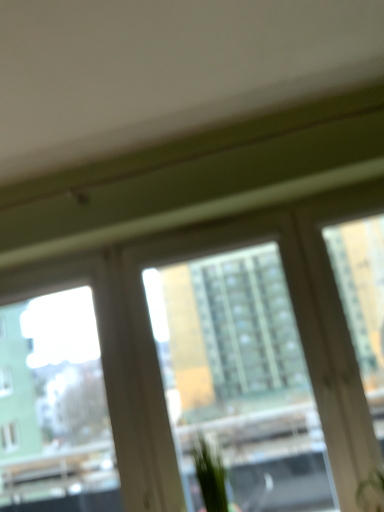
Question: Considering the relative sizes of green matte plant at lower right, placed as the first plant when sorted from right to left, and transparent glass window screen at left in the image provided, is green matte plant at lower right, placed as the first plant when sorted from right to left, thinner than transparent glass window screen at left?

Choices:
 (A) no
 (B) yes

Answer: (A)

Question: Does green matte plant at lower right, placed as the first plant when sorted from right to left, have a smaller size compared to transparent glass window screen at left?

Choices:
 (A) no
 (B) yes

Answer: (B)

Question: Is green matte plant at lower right, placed as the first plant when sorted from right to left, closer to camera compared to transparent glass window screen at left?

Choices:
 (A) no
 (B) yes

Answer: (B)

Question: Is green matte plant at lower right, arranged as the 2th plant when viewed from the left, far from transparent glass window screen at left?

Choices:
 (A) no
 (B) yes

Answer: (B)

Question: Could you tell me if green matte plant at lower right, placed as the first plant when sorted from right to left, is turned towards transparent glass window screen at left?

Choices:
 (A) yes
 (B) no

Answer: (B)

Question: From a real-world perspective, is green matte plant at lower right, placed as the first plant when sorted from right to left, on transparent glass window screen at left?

Choices:
 (A) no
 (B) yes

Answer: (A)

Question: From the image's perspective, is transparent glass window screen at left under transparent glass window at center?

Choices:
 (A) yes
 (B) no

Answer: (A)

Question: From a real-world perspective, is transparent glass window screen at left on transparent glass window at center?

Choices:
 (A) no
 (B) yes

Answer: (B)

Question: Does transparent glass window screen at left appear on the left side of transparent glass window at center?

Choices:
 (A) yes
 (B) no

Answer: (A)

Question: Are transparent glass window screen at left and transparent glass window at center far apart?

Choices:
 (A) yes
 (B) no

Answer: (B)

Question: Is transparent glass window screen at left bigger than transparent glass window at center?

Choices:
 (A) no
 (B) yes

Answer: (A)

Question: From a real-world perspective, is transparent glass window screen at left positioned under transparent glass window at center based on gravity?

Choices:
 (A) no
 (B) yes

Answer: (A)

Question: From the image's perspective, would you say transparent glass window at center is shown under green leafy plant at center, the 2th plant when ordered from right to left?

Choices:
 (A) no
 (B) yes

Answer: (A)